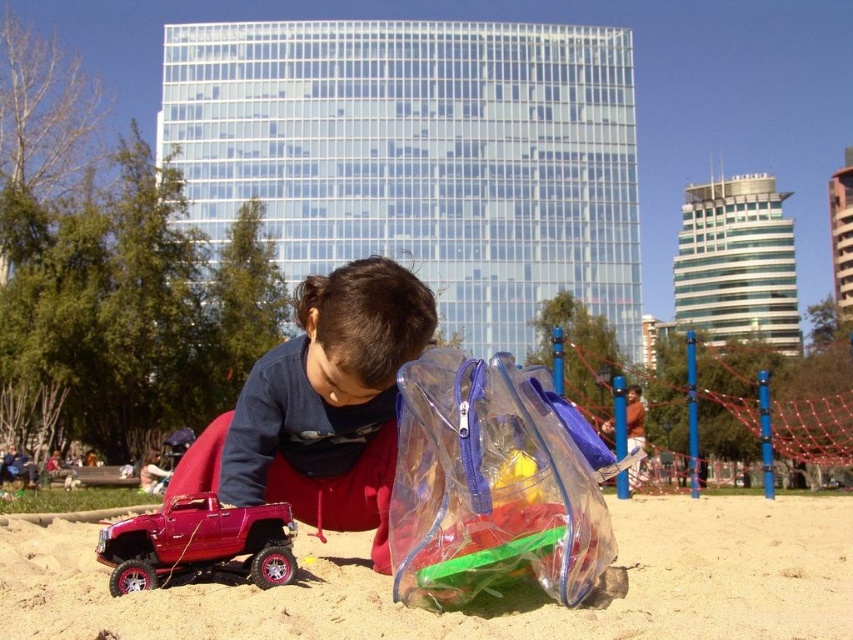
Who is lower down, dark blue fabric at center or shiny red plastic toy car at lower left?

shiny red plastic toy car at lower left is below.

Is dark blue fabric at center closer to the viewer compared to shiny red plastic toy car at lower left?

Result: That is False.

Measure the distance between dark blue fabric at center and camera.

dark blue fabric at center is 9.89 meters away from camera.

This screenshot has height=640, width=853. What are the coordinates of `dark blue fabric at center` in the screenshot? It's located at (329, 403).

Does fine-grained sand at lower center come in front of shiny red plastic toy car at lower left?

Yes, fine-grained sand at lower center is closer to the viewer.

Does fine-grained sand at lower center appear on the right side of shiny red plastic toy car at lower left?

Yes, fine-grained sand at lower center is to the right of shiny red plastic toy car at lower left.

Locate an element on the screen. fine-grained sand at lower center is located at coordinates (486, 604).

Who is taller, fine-grained sand at lower center or transparent plastic bag at center?

fine-grained sand at lower center

Is fine-grained sand at lower center shorter than transparent plastic bag at center?

Incorrect, fine-grained sand at lower center's height does not fall short of transparent plastic bag at center's.

Does point (434, 634) come behind point (494, 369)?

No.

Where is `fine-grained sand at lower center`? Image resolution: width=853 pixels, height=640 pixels. fine-grained sand at lower center is located at coordinates (486, 604).